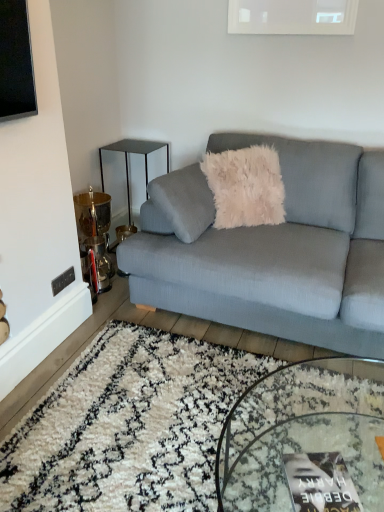
Question: Is textured gray couch at center surrounded by clear glass coffee table at center?

Choices:
 (A) yes
 (B) no

Answer: (B)

Question: Considering the relative sizes of clear glass coffee table at center and textured gray couch at center in the image provided, is clear glass coffee table at center shorter than textured gray couch at center?

Choices:
 (A) yes
 (B) no

Answer: (A)

Question: Does clear glass coffee table at center have a greater height compared to textured gray couch at center?

Choices:
 (A) yes
 (B) no

Answer: (B)

Question: Is clear glass coffee table at center in front of textured gray couch at center?

Choices:
 (A) no
 (B) yes

Answer: (B)

Question: From the image's perspective, does clear glass coffee table at center appear higher than textured gray couch at center?

Choices:
 (A) no
 (B) yes

Answer: (A)

Question: Considering the relative sizes of clear glass coffee table at center and textured gray couch at center in the image provided, is clear glass coffee table at center wider than textured gray couch at center?

Choices:
 (A) no
 (B) yes

Answer: (A)

Question: Is textured gray couch at center at the right side of metallic black side table at upper left?

Choices:
 (A) no
 (B) yes

Answer: (B)

Question: Can you confirm if textured gray couch at center is shorter than metallic black side table at upper left?

Choices:
 (A) no
 (B) yes

Answer: (A)

Question: Is textured gray couch at center smaller than metallic black side table at upper left?

Choices:
 (A) yes
 (B) no

Answer: (B)

Question: Are textured gray couch at center and metallic black side table at upper left beside each other?

Choices:
 (A) yes
 (B) no

Answer: (B)

Question: Is textured gray couch at center positioned far away from metallic black side table at upper left?

Choices:
 (A) no
 (B) yes

Answer: (B)

Question: Is textured gray couch at center taller than metallic black side table at upper left?

Choices:
 (A) yes
 (B) no

Answer: (A)

Question: Is textured gray couch at center looking in the opposite direction of clear glass coffee table at center?

Choices:
 (A) no
 (B) yes

Answer: (A)